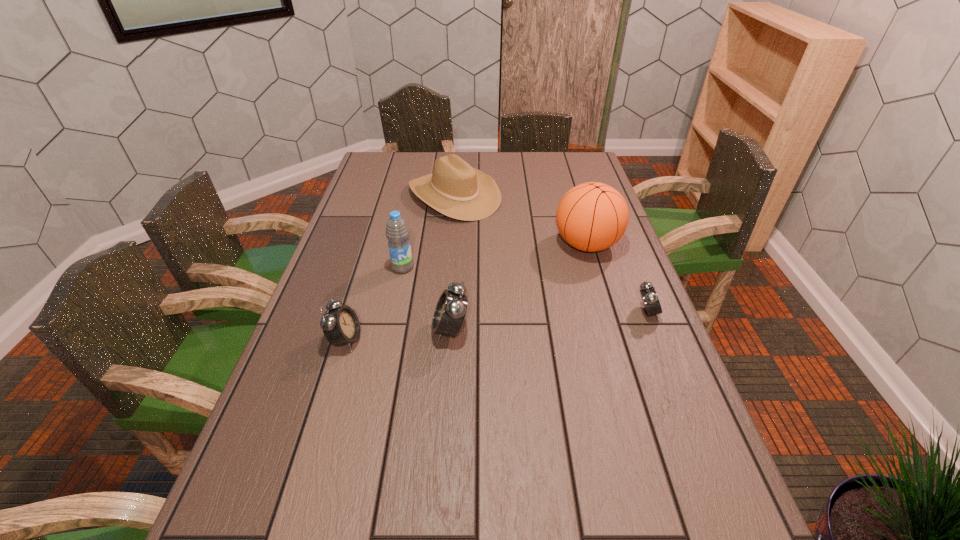
What are the coordinates of `free space between the second alarm clock from left to right and the basketball` in the screenshot? It's located at (518, 287).

Locate an element on the screen. unoccupied area between the shortest alarm clock and the tallest alarm clock is located at coordinates (549, 321).

Identify the location of empty location between the second shortest alarm clock and the water bottle. (374, 303).

Locate which object is the closest to the basketball. Please provide its 2D coordinates. Your answer should be formatted as a tuple, i.e. [(x, y)], where the tuple contains the x and y coordinates of a point satisfying the conditions above.

[(455, 189)]

Find the location of a particular element. object that is the fourth closest to the shortest object is located at coordinates (397, 232).

I want to click on the second closest alarm clock to the shortest object, so click(x=341, y=326).

Choose which alarm clock is the nearest neighbor to the second alarm clock from right to left. Please provide its 2D coordinates. Your answer should be formatted as a tuple, i.e. [(x, y)], where the tuple contains the x and y coordinates of a point satisfying the conditions above.

[(341, 326)]

Where is `vacant area in the image that satisfies the following two spatial constraints: 1. on the front side of the cowboy hat; 2. on the face of the leftmost object`? This screenshot has height=540, width=960. vacant area in the image that satisfies the following two spatial constraints: 1. on the front side of the cowboy hat; 2. on the face of the leftmost object is located at coordinates (443, 340).

Where is `free space that satisfies the following two spatial constraints: 1. on the front side of the basketball; 2. on the face of the tallest alarm clock`? The width and height of the screenshot is (960, 540). free space that satisfies the following two spatial constraints: 1. on the front side of the basketball; 2. on the face of the tallest alarm clock is located at coordinates (612, 330).